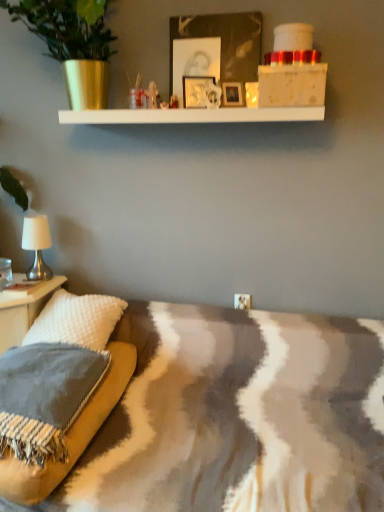
Question: Do you think textured gray pillow at lower left is within metallic silver picture frame at upper center, or outside of it?

Choices:
 (A) inside
 (B) outside

Answer: (B)

Question: Relative to metallic silver picture frame at upper center, is textured gray pillow at lower left in front or behind?

Choices:
 (A) behind
 (B) front

Answer: (B)

Question: Based on their relative distances, which object is farther from the textured gray pillow at lower left?

Choices:
 (A) white fabric lampshade at left
 (B) metallic silver picture frame at upper center
 (C) white textured pillow at left

Answer: (B)

Question: Based on their relative distances, which object is farther from the metallic silver picture frame at upper center?

Choices:
 (A) white fabric lampshade at left
 (B) textured gray pillow at lower left
 (C) white textured pillow at left

Answer: (B)